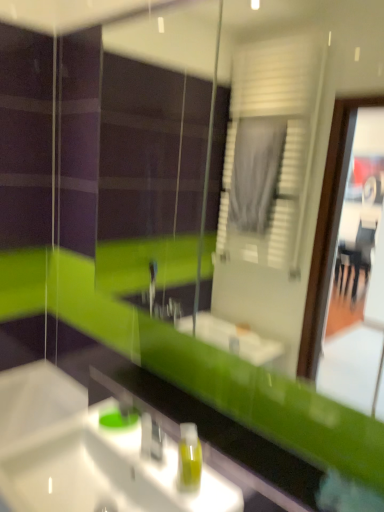
I want to click on green translucent soap dispenser at lower center, so click(x=189, y=458).

Where is `white glossy sink at lower left`? Image resolution: width=384 pixels, height=512 pixels. white glossy sink at lower left is located at coordinates (87, 454).

In order to click on teal glass soap dispenser at center in this screenshot , I will do `click(119, 418)`.

In the scene shown: From a real-world perspective, is white glossy sink at lower left positioned above or below teal glass soap dispenser at center?

white glossy sink at lower left is below teal glass soap dispenser at center.

Is point (42, 508) closer or farther from the camera than point (124, 424)?

Point (42, 508) is closer to the camera than point (124, 424).

In the scene shown: From the image's perspective, between white glossy sink at lower left and teal glass soap dispenser at center, which one is located above?

teal glass soap dispenser at center, from the image's perspective.

Does point (186, 436) come closer to viewer compared to point (123, 465)?

That is True.

From a real-world perspective, which object rests below the other?

white glossy sink at lower left is physically lower.

Can you tell me how much green translucent soap dispenser at lower center and white glossy sink at lower left differ in facing direction?

38.2 degrees.

Could you measure the distance between green translucent soap dispenser at lower center and white glossy sink at lower left?

They are 7.03 inches apart.

Based on the photo, from a real-world perspective, is teal glass soap dispenser at center on top of green translucent soap dispenser at lower center?

No, from a real-world perspective, teal glass soap dispenser at center is not over green translucent soap dispenser at lower center

Does point (119, 404) come farther from viewer compared to point (188, 448)?

Yes, point (119, 404) is behind point (188, 448).

Would you say teal glass soap dispenser at center is a long distance from green translucent soap dispenser at lower center?

Actually, teal glass soap dispenser at center and green translucent soap dispenser at lower center are a little close together.

Based on their sizes in the image, would you say teal glass soap dispenser at center is bigger or smaller than green translucent soap dispenser at lower center?

teal glass soap dispenser at center is smaller than green translucent soap dispenser at lower center.

Is green translucent soap dispenser at lower center facing towards teal glass soap dispenser at center?

No, green translucent soap dispenser at lower center is not oriented towards teal glass soap dispenser at center.

Is green translucent soap dispenser at lower center wider than teal glass soap dispenser at center?

In fact, green translucent soap dispenser at lower center might be narrower than teal glass soap dispenser at center.

Find the location of a particular element. This screenshot has height=512, width=384. teal located behind the green translucent soap dispenser at lower center is located at coordinates (119, 418).

Considering the relative sizes of green translucent soap dispenser at lower center and teal glass soap dispenser at center in the image provided, is green translucent soap dispenser at lower center taller than teal glass soap dispenser at center?

Indeed, green translucent soap dispenser at lower center has a greater height compared to teal glass soap dispenser at center.

Is teal glass soap dispenser at center in front of or behind white glossy sink at lower left in the image?

Clearly, teal glass soap dispenser at center is behind white glossy sink at lower left.

Is teal glass soap dispenser at center surrounding white glossy sink at lower left?

No, white glossy sink at lower left is located outside of teal glass soap dispenser at center.

Is teal glass soap dispenser at center touching white glossy sink at lower left?

teal glass soap dispenser at center and white glossy sink at lower left are not in contact.

Is white glossy sink at lower left not close to green translucent soap dispenser at lower center?

No, there isn't a large distance between white glossy sink at lower left and green translucent soap dispenser at lower center.

Is white glossy sink at lower left spatially inside green translucent soap dispenser at lower center, or outside of it?

white glossy sink at lower left exists outside the volume of green translucent soap dispenser at lower center.

Is point (20, 456) closer to camera compared to point (186, 459)?

No, it is not.

At what (x,y) coordinates should I click in order to perform the action: click on teal on the left of white glossy sink at lower left. Please return your answer as a coordinate pair (x, y). Looking at the image, I should click on (119, 418).

This screenshot has height=512, width=384. Identify the location of soap dispenser above the white glossy sink at lower left (from a real-world perspective). (189, 458).

Considering their positions, is green translucent soap dispenser at lower center positioned further to teal glass soap dispenser at center than white glossy sink at lower left?

green translucent soap dispenser at lower center is further to teal glass soap dispenser at center.

Estimate the real-world distances between objects in this image. Which object is closer to teal glass soap dispenser at center, white glossy sink at lower left or green translucent soap dispenser at lower center?

Based on the image, white glossy sink at lower left appears to be nearer to teal glass soap dispenser at center.

Estimate the real-world distances between objects in this image. Which object is closer to white glossy sink at lower left, green translucent soap dispenser at lower center or teal glass soap dispenser at center?

Based on the image, teal glass soap dispenser at center appears to be nearer to white glossy sink at lower left.

From the image, which object appears to be farther from white glossy sink at lower left, teal glass soap dispenser at center or green translucent soap dispenser at lower center?

green translucent soap dispenser at lower center.

When comparing their distances from green translucent soap dispenser at lower center, does teal glass soap dispenser at center or white glossy sink at lower left seem further?

teal glass soap dispenser at center is positioned further to the anchor green translucent soap dispenser at lower center.

From the image, which object appears to be farther from green translucent soap dispenser at lower center, white glossy sink at lower left or teal glass soap dispenser at center?

teal glass soap dispenser at center is further to green translucent soap dispenser at lower center.

Find the location of a particular element. The width and height of the screenshot is (384, 512). soap dispenser positioned between white glossy sink at lower left and teal glass soap dispenser at center from near to far is located at coordinates (189, 458).